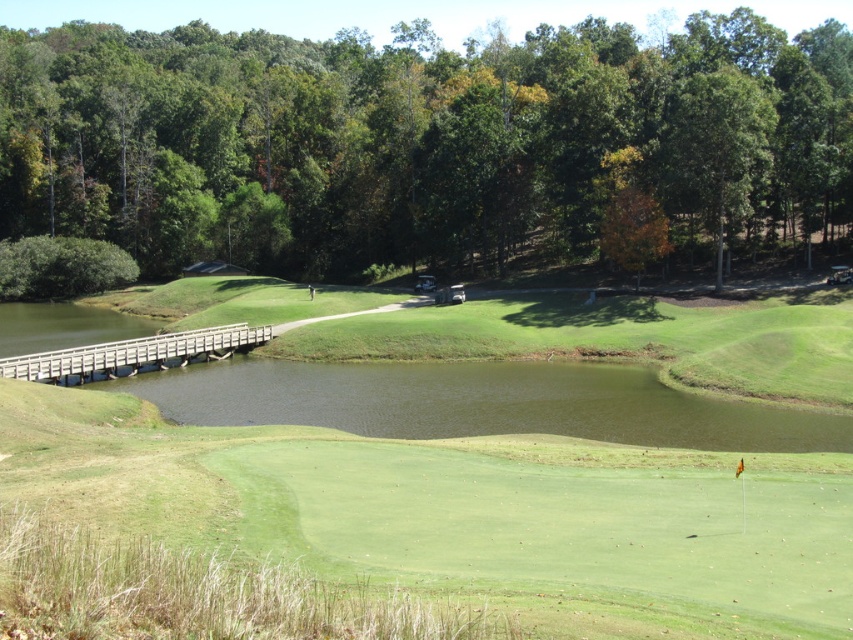
In the scene shown: You are a golfer trying to decide whether to carry a golf bag across the wooden bridge at lower left or around the orange leafy tree at upper center. Which path would allow you to move more comfortably?

The wooden bridge at lower left has a larger width than the orange leafy tree at upper center, so moving across the wooden bridge at lower left would allow for more comfortable movement.

In the scene shown: You are a golfer standing on the wooden bridge at lower left, trying to hit a ball to the green grassy golf course at center. Is the golf course below or above the bridge?

The green grassy golf course at center is located below the wooden bridge at lower left, so the golf course is below the bridge.